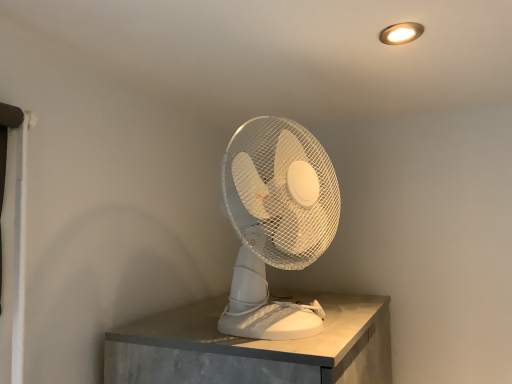
Where is `vacant space behind matte gold light fixture at upper right`? vacant space behind matte gold light fixture at upper right is located at coordinates (378, 62).